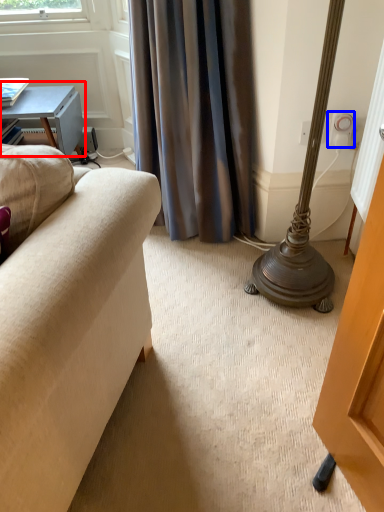
Question: Among these objects, which one is nearest to the camera, table (highlighted by a red box) or electric outlet (highlighted by a blue box)?

Choices:
 (A) table
 (B) electric outlet

Answer: (B)